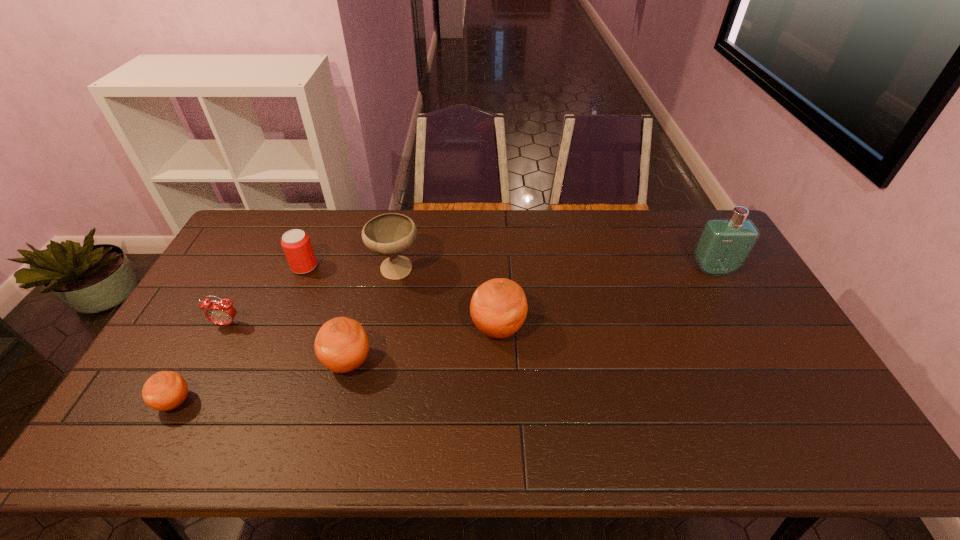
Find the location of a particular element. This screenshot has width=960, height=540. the leftmost orange is located at coordinates (166, 390).

You are a GUI agent. You are given a task and a screenshot of the screen. Output one action in this format:
    pyautogui.click(x=<x>, y=<y>)
    Task: Click on the nearest object
    
    Given the screenshot: What is the action you would take?
    pyautogui.click(x=166, y=390)

This screenshot has width=960, height=540. Find the location of `the second tallest orange`. the second tallest orange is located at coordinates (341, 345).

Locate an element on the screen. This screenshot has height=540, width=960. the rightmost orange is located at coordinates (498, 308).

Find the location of a particular element. beer can is located at coordinates (296, 244).

The height and width of the screenshot is (540, 960). I want to click on chalice, so click(391, 234).

This screenshot has width=960, height=540. In order to click on the rightmost object in this screenshot , I will do `click(724, 245)`.

Image resolution: width=960 pixels, height=540 pixels. I want to click on the tallest object, so click(724, 245).

Locate an element on the screen. The height and width of the screenshot is (540, 960). alarm clock is located at coordinates click(222, 312).

Image resolution: width=960 pixels, height=540 pixels. I want to click on vacant space located 0.370m on the back of the nearest object, so click(239, 286).